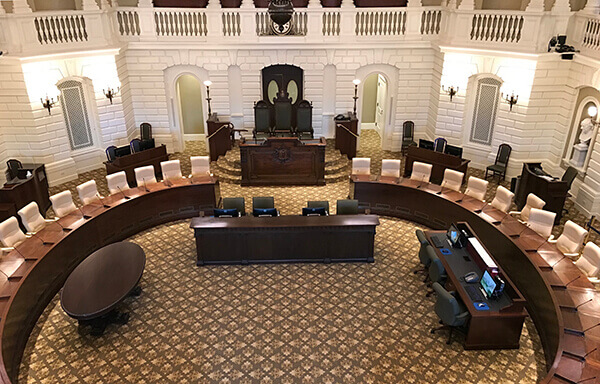
Find the location of `fence on balcony`. fence on balcony is located at coordinates (55, 31), (499, 26).